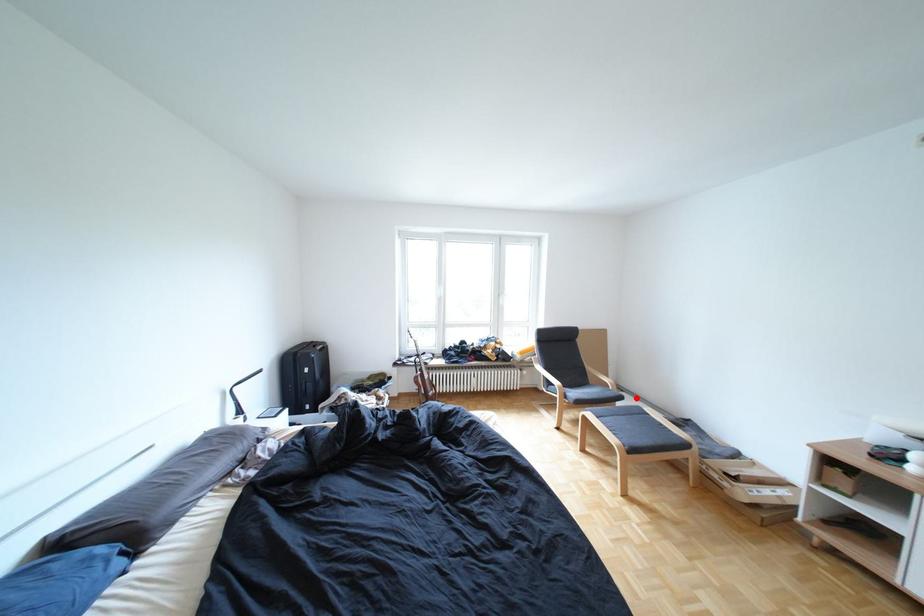
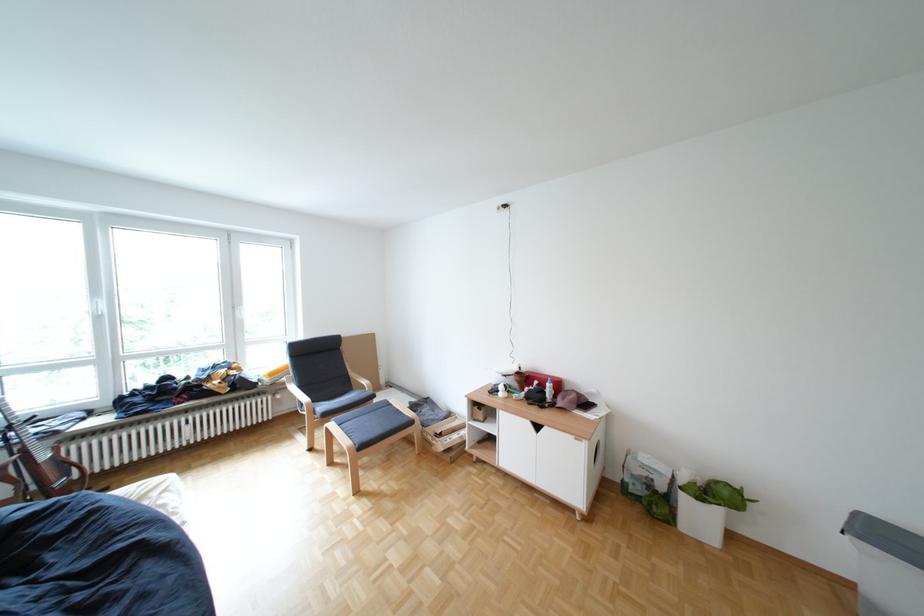
Question: I am providing you with two images of the same scene from different viewpoints. In image1, a red point is highlighted. Considering the same 3D point in image2, which of the following is correct?

Choices:
 (A) It is closer
 (B) It is farther

Answer: (A)